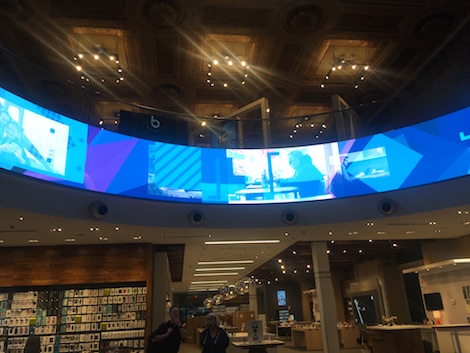
Locate an element on the screen. The width and height of the screenshot is (470, 353). cieling is located at coordinates (223, 250).